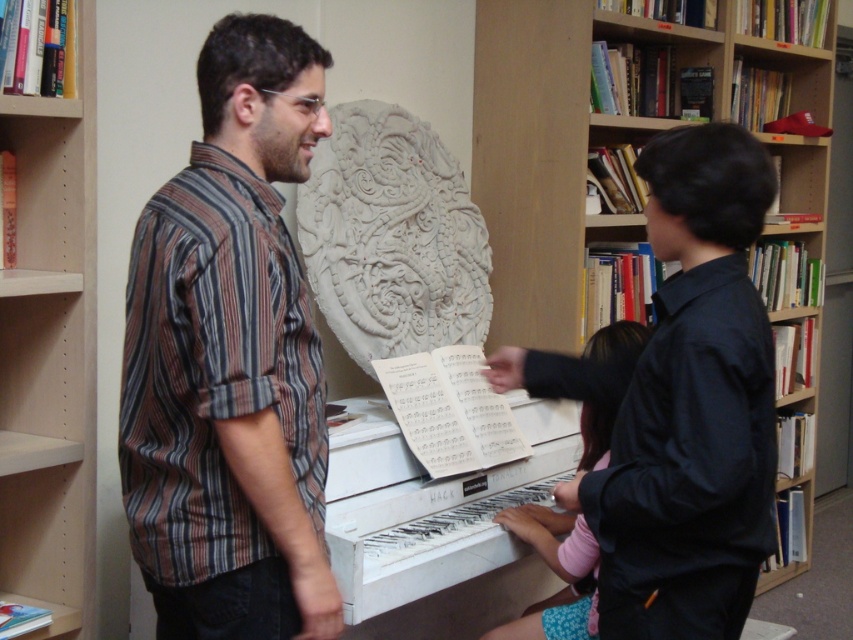
You are standing in the library and want to take a photo of the striped cotton shirt at center and the white matte piano at center. Which object will appear larger in your photo?

The striped cotton shirt at center appears larger in the photo because it is closer to the viewer than the white matte piano at center.

You are a visitor in the library and want to take a photo of the white matte piano at center without the pink fabric at piano appearing in the shot. How should you position yourself relative to the piano?

To avoid capturing the pink fabric at piano in your photo, position yourself in front of the white matte piano at center so that the pink fabric at piano, which is located behind the piano, is out of the frame.

You are a music teacher who wants to place a new sheet of music between the white matte piano at center and the pink fabric at piano. The sheet is 10 inches wide. Can the sheet fit between them?

The white matte piano at center and pink fabric at piano are 9.52 inches apart from each other. Since the sheet is 10 inches wide, it cannot fit between them as the space is narrower than the sheet.